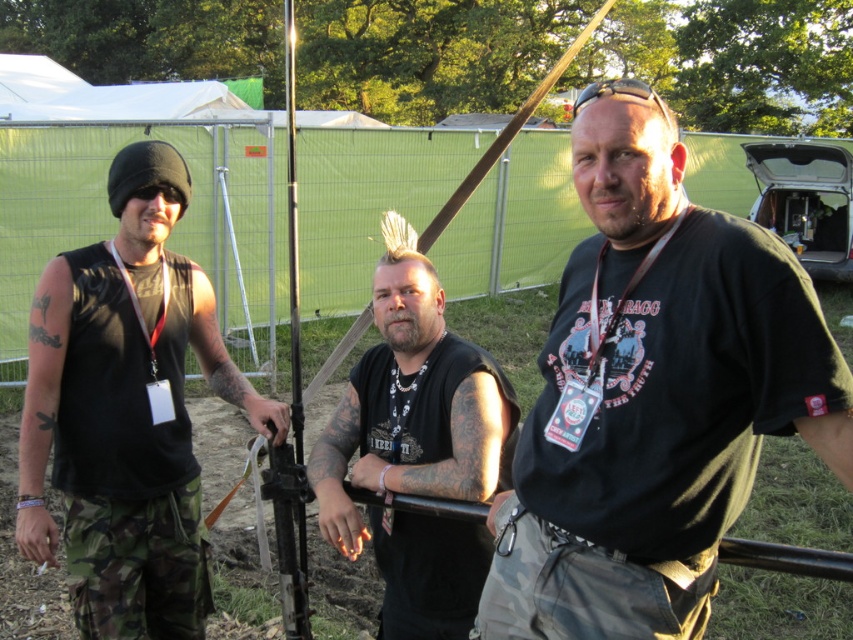
Question: Which is nearer to the black matte vest at center?

Choices:
 (A) camouflage pants at lower left
 (B) matte black tank top at left

Answer: (B)

Question: Is black matte vest at center to the left of camouflage pants at lower left from the viewer's perspective?

Choices:
 (A) yes
 (B) no

Answer: (B)

Question: Is black matte vest at center positioned behind camouflage pants at lower left?

Choices:
 (A) no
 (B) yes

Answer: (A)

Question: Which is nearer to the black matte vest at center?

Choices:
 (A) black matte t-shirt at center
 (B) matte black tank top at left
 (C) camouflage pants at lower left

Answer: (A)

Question: Among these points, which one is farthest from the camera?

Choices:
 (A) (737, 289)
 (B) (207, 592)

Answer: (B)

Question: Considering the relative positions of matte black tank top at left and black matte vest at center in the image provided, where is matte black tank top at left located with respect to black matte vest at center?

Choices:
 (A) right
 (B) left

Answer: (B)